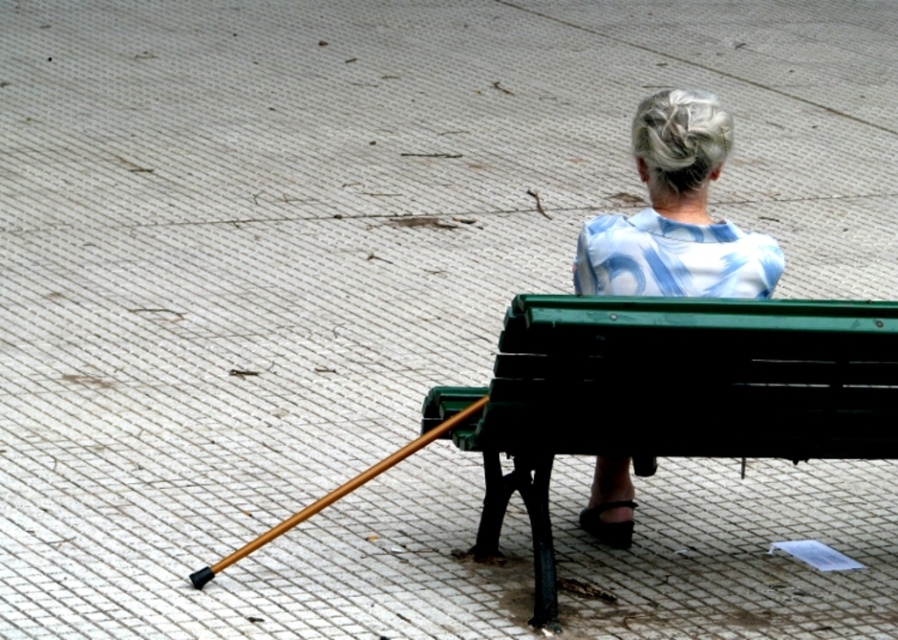
Question: Which object appears farthest from the camera in this image?

Choices:
 (A) blue patterned blouse at center
 (B) wooden cane at lower left

Answer: (B)

Question: Does blue patterned blouse at center appear on the right side of wooden cane at lower left?

Choices:
 (A) no
 (B) yes

Answer: (B)

Question: Which point is farther from the camera taking this photo?

Choices:
 (A) (654, 380)
 (B) (409, 444)

Answer: (B)

Question: Which object is closer to the camera taking this photo?

Choices:
 (A) wooden cane at lower left
 (B) green painted wood bench at center

Answer: (B)

Question: Does blue patterned blouse at center lie in front of wooden cane at lower left?

Choices:
 (A) no
 (B) yes

Answer: (B)

Question: Observing the image, what is the correct spatial positioning of green painted wood bench at center in reference to blue patterned blouse at center?

Choices:
 (A) below
 (B) above

Answer: (A)